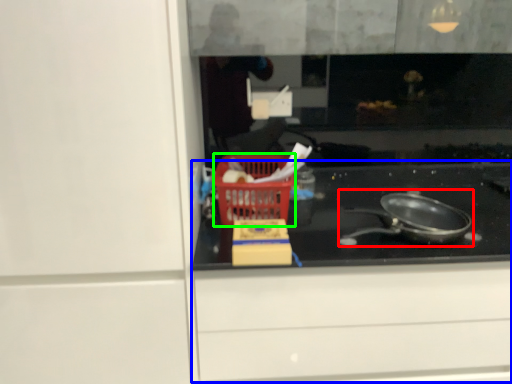
Question: Which object is positioned closest to frying pan (highlighted by a red box)? Select from cabinetry (highlighted by a blue box) and basket (highlighted by a green box).

Choices:
 (A) cabinetry
 (B) basket

Answer: (A)